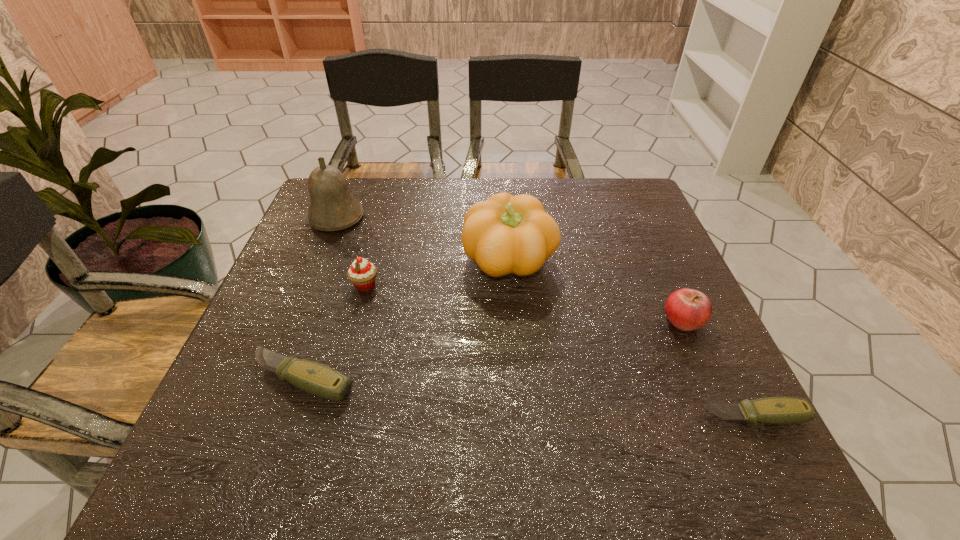
Find the location of a particular element. vacant space that satisfies the following two spatial constraints: 1. on the back side of the fifth tallest object; 2. on the right side of the apple is located at coordinates (324, 320).

Locate an element on the screen. Image resolution: width=960 pixels, height=540 pixels. free space that satisfies the following two spatial constraints: 1. on the front side of the bell; 2. on the left side of the cupcake is located at coordinates (309, 285).